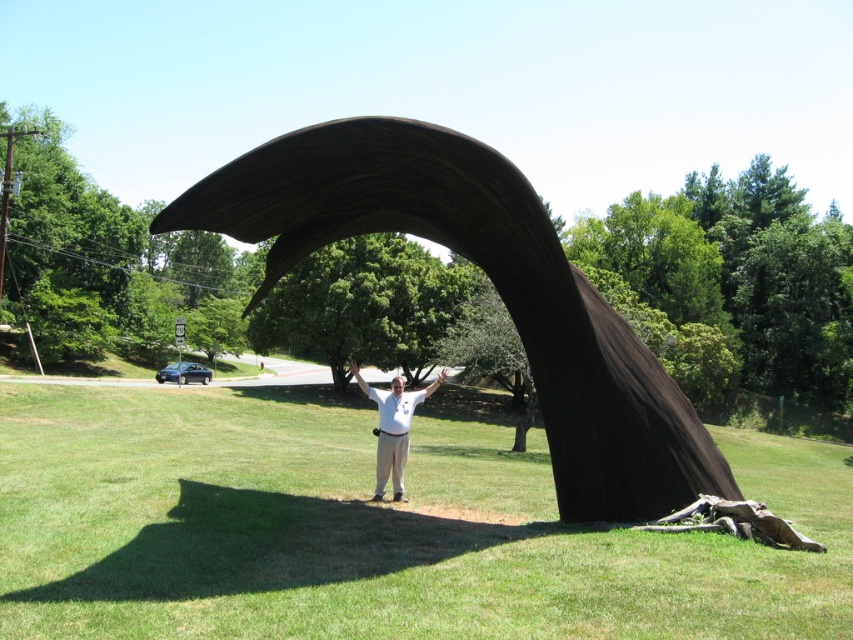
Does black polished wood arch at center lie behind green leafy tree at center?

No, it is not.

Is the position of black polished wood arch at center less distant than that of green leafy tree at center?

Yes, black polished wood arch at center is in front of green leafy tree at center.

Which is behind, point (160, 214) or point (346, 253)?

Point (346, 253)

This screenshot has height=640, width=853. I want to click on black polished wood arch at center, so click(492, 284).

Does green leafy tree at center have a greater height compared to white matte shirt at center?

Correct, green leafy tree at center is much taller as white matte shirt at center.

Find the location of a particular element. green leafy tree at center is located at coordinates (364, 307).

What do you see at coordinates (364, 307) in the screenshot?
I see `green leafy tree at center` at bounding box center [364, 307].

Identify the location of green leafy tree at center. This screenshot has height=640, width=853. (364, 307).

Does green grass at center lie behind black polished wood arch at center?

No, it is in front of black polished wood arch at center.

Can you confirm if green grass at center is positioned to the left of black polished wood arch at center?

Correct, you'll find green grass at center to the left of black polished wood arch at center.

Is point (68, 417) positioned in front of point (321, 166)?

No.

Where is `green grass at center`? The height and width of the screenshot is (640, 853). green grass at center is located at coordinates [370, 531].